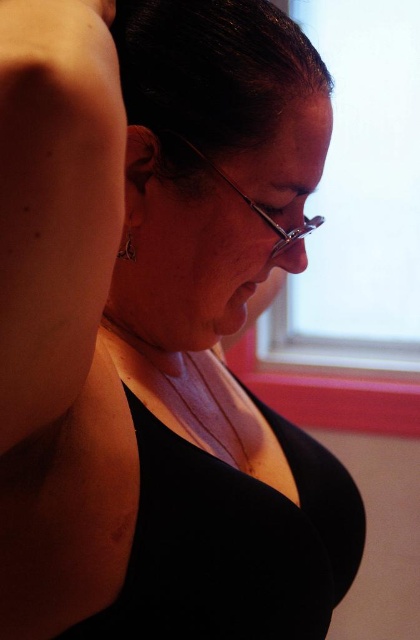
Question: Which object is the farthest from the black matte dress at center?

Choices:
 (A) black matte tank top at center
 (B) silver metallic earring at upper left
 (C) dark shiny hair at upper center

Answer: (C)

Question: Does black matte dress at center appear under dark shiny hair at upper center?

Choices:
 (A) no
 (B) yes

Answer: (B)

Question: Which object appears farthest from the camera in this image?

Choices:
 (A) black matte tank top at center
 (B) dark shiny hair at upper center
 (C) silver metallic earring at upper left
 (D) black matte dress at center

Answer: (C)

Question: Which of the following is the farthest from the observer?

Choices:
 (A) (155, 435)
 (B) (226, 77)
 (C) (228, 628)

Answer: (A)

Question: From the image, what is the correct spatial relationship of black matte tank top at center in relation to dark shiny hair at upper center?

Choices:
 (A) right
 (B) left

Answer: (B)

Question: Is black matte dress at center to the right of dark shiny hair at upper center from the viewer's perspective?

Choices:
 (A) no
 (B) yes

Answer: (B)